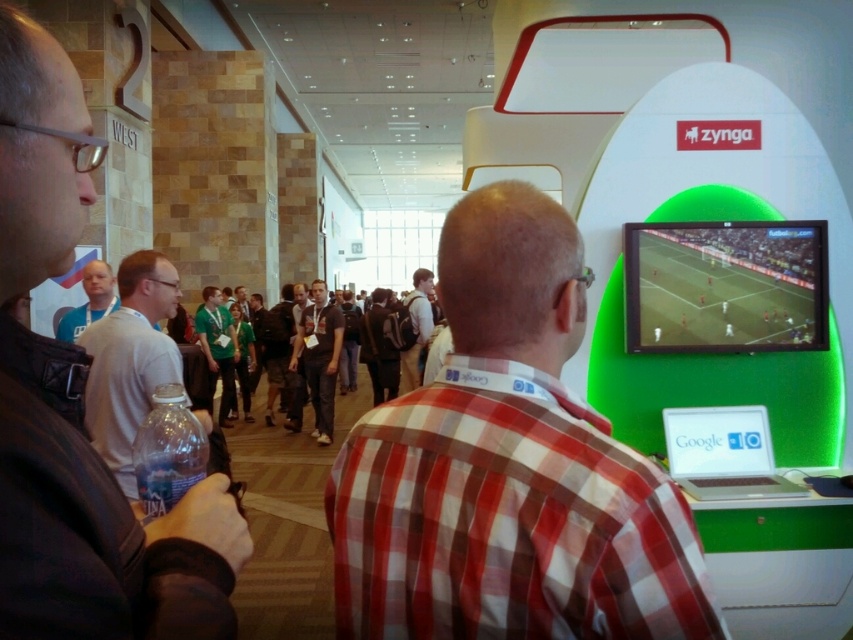
You are standing in the convention center and see the plaid shirt at center and the dark brown leather jacket at left. Which one is closer to the ground?

The plaid shirt at center is below dark brown leather jacket at left, so the plaid shirt at center is closer to the ground.

You are a photographer trying to capture a photo of the plaid shirt at center and the dark brown leather jacket at left. Can you fit both subjects in the frame if your camera has a 1.5 meter wide field of view?

The plaid shirt at center might be wider than dark brown leather jacket at left, but the total width of both subjects combined is not specified. However, since the camera has a 1.5 meter wide field of view, it is possible to fit both subjects in the frame if their combined width is within that limit.